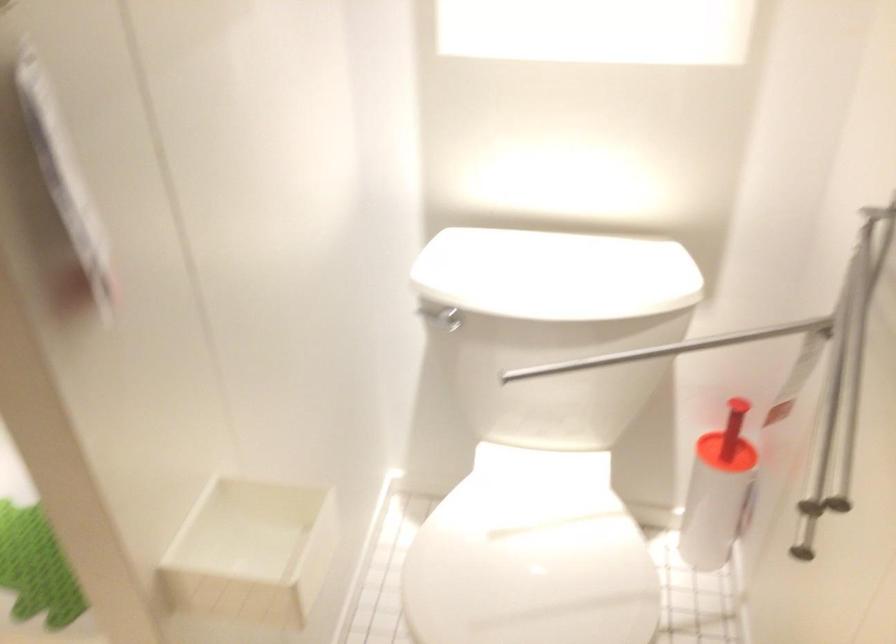
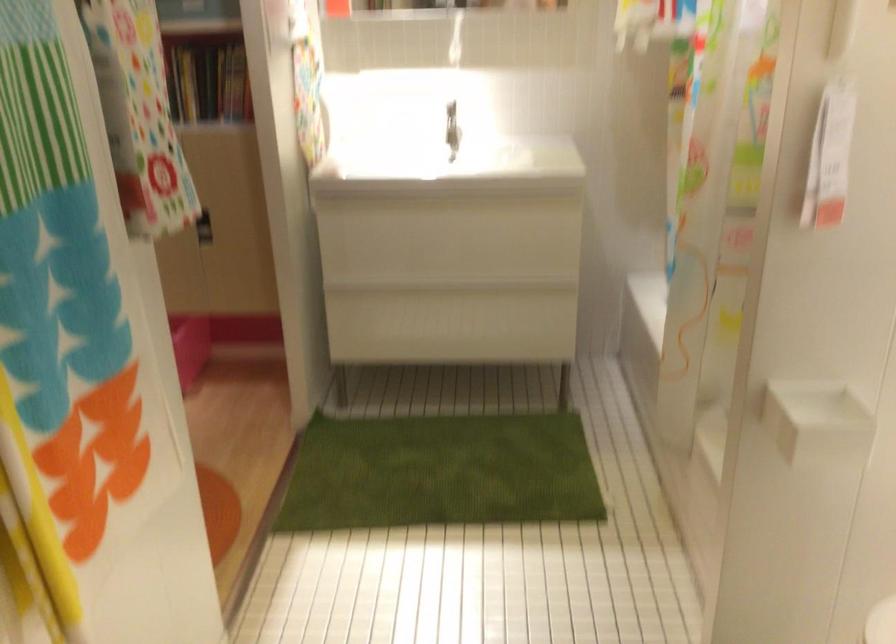
In the second image, find the point that corresponds to pixel 234 569 in the first image.

(816, 422)